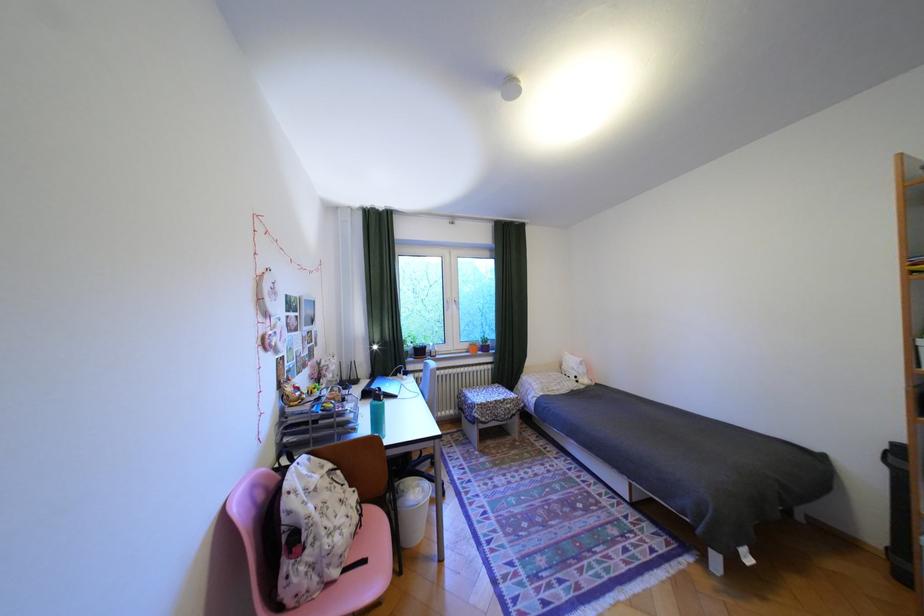
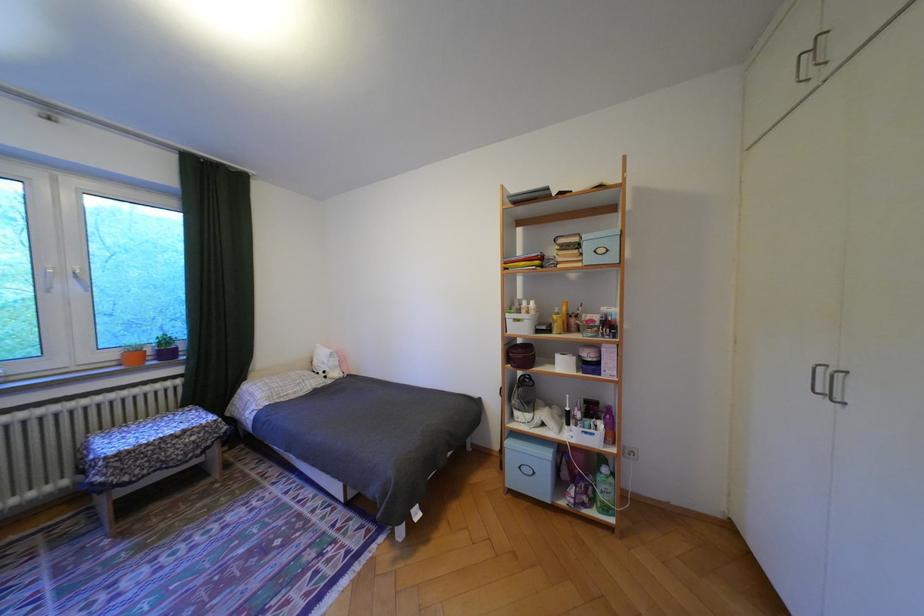
Question: The images are taken continuously from a first-person perspective. In which direction is your viewpoint rotating?

Choices:
 (A) Left
 (B) Right
 (C) Up
 (D) Down

Answer: (B)